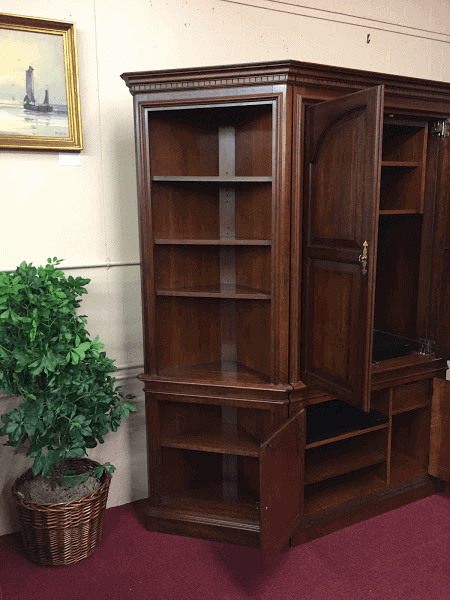
You are a GUI agent. You are given a task and a screenshot of the screen. Output one action in this format:
    pyautogui.click(x=<x>, y=<y>)
    Task: Click on the carpte
    
    Given the screenshot: What is the action you would take?
    pyautogui.click(x=112, y=550)